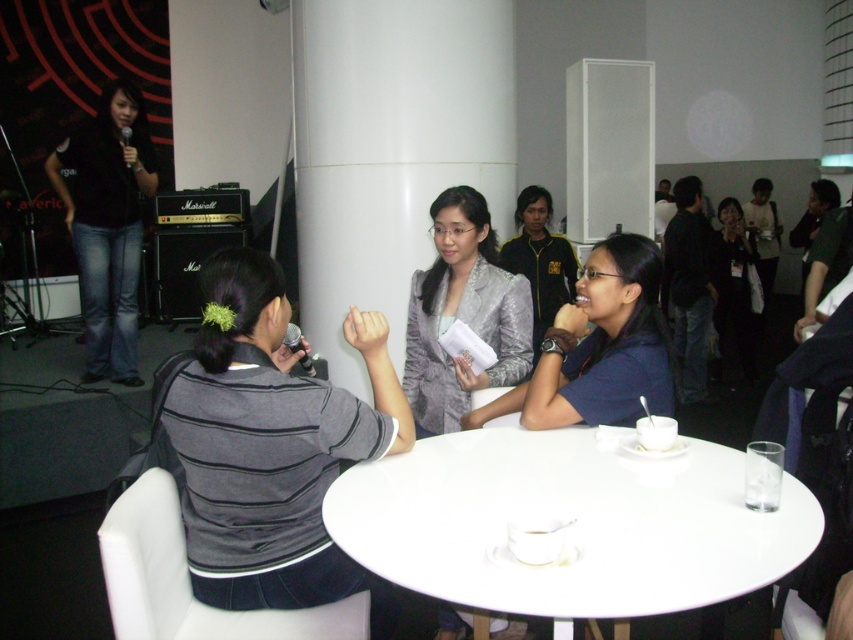
Is point (453, 509) in front of point (97, 312)?

Yes.

Between white glossy table at center and black denim jeans at left, which one has more height?

With more height is black denim jeans at left.

Is point (689, 564) behind point (128, 384)?

That is False.

Identify the location of white glossy table at center. (567, 528).

Who is taller, gray striped shirt at left or blue fabric shirt at center?

gray striped shirt at left is taller.

Does gray striped shirt at left have a greater width compared to blue fabric shirt at center?

Indeed, gray striped shirt at left has a greater width compared to blue fabric shirt at center.

This screenshot has width=853, height=640. Identify the location of gray striped shirt at left. (273, 448).

This screenshot has height=640, width=853. Identify the location of gray striped shirt at left. (273, 448).

What do you see at coordinates (567, 528) in the screenshot? I see `white glossy table at center` at bounding box center [567, 528].

Identify the location of white glossy table at center. (567, 528).

Measure the distance between point (408, 468) and camera.

Point (408, 468) is 6.02 feet away from camera.

At what (x,y) coordinates should I click in order to perform the action: click on white glossy table at center. Please return your answer as a coordinate pair (x, y). This screenshot has height=640, width=853. Looking at the image, I should click on (567, 528).